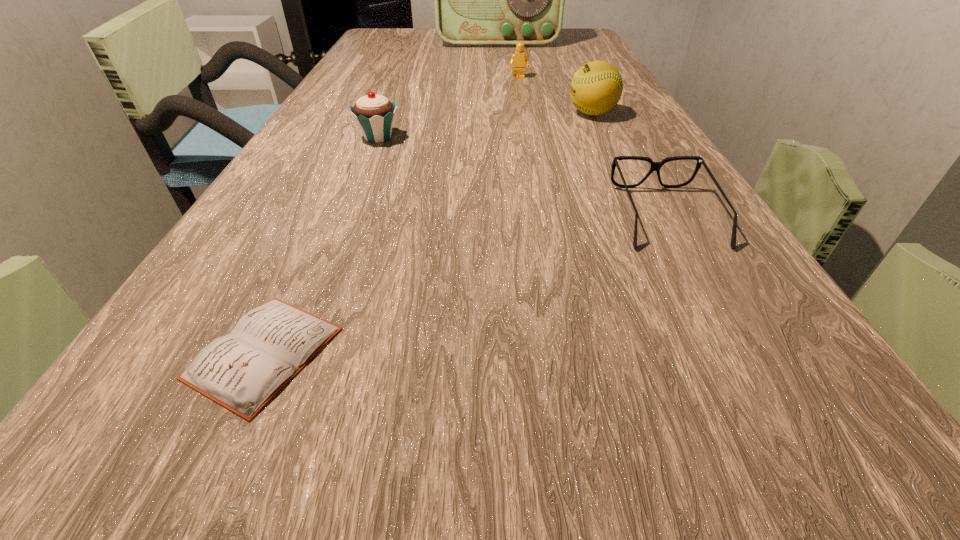
Where is `radio receiver at the right edge`? The width and height of the screenshot is (960, 540). radio receiver at the right edge is located at coordinates (479, 0).

Identify the location of softball that is at the right edge. The width and height of the screenshot is (960, 540). (596, 88).

Where is `spectacles present at the right edge`? The image size is (960, 540). spectacles present at the right edge is located at coordinates (655, 166).

Locate an element on the screen. object at the far right corner is located at coordinates (479, 0).

In the image, there is a desktop. In order to click on free space at the left edge in this screenshot , I will do `click(316, 112)`.

I want to click on blank area at the right edge, so click(636, 114).

You are a GUI agent. You are given a task and a screenshot of the screen. Output one action in this format:
    pyautogui.click(x=<x>, y=<y>)
    Task: Click on the free space at the far left corner of the desktop
    
    Given the screenshot: What is the action you would take?
    pyautogui.click(x=406, y=30)

This screenshot has width=960, height=540. What are the coordinates of `empty location between the second nearest object and the tallest object` in the screenshot? It's located at (582, 129).

Where is `free spot between the second shortest object and the nearest object`? The image size is (960, 540). free spot between the second shortest object and the nearest object is located at coordinates tap(465, 285).

Image resolution: width=960 pixels, height=540 pixels. I want to click on blank region between the fifth nearest object and the radio receiver, so click(508, 60).